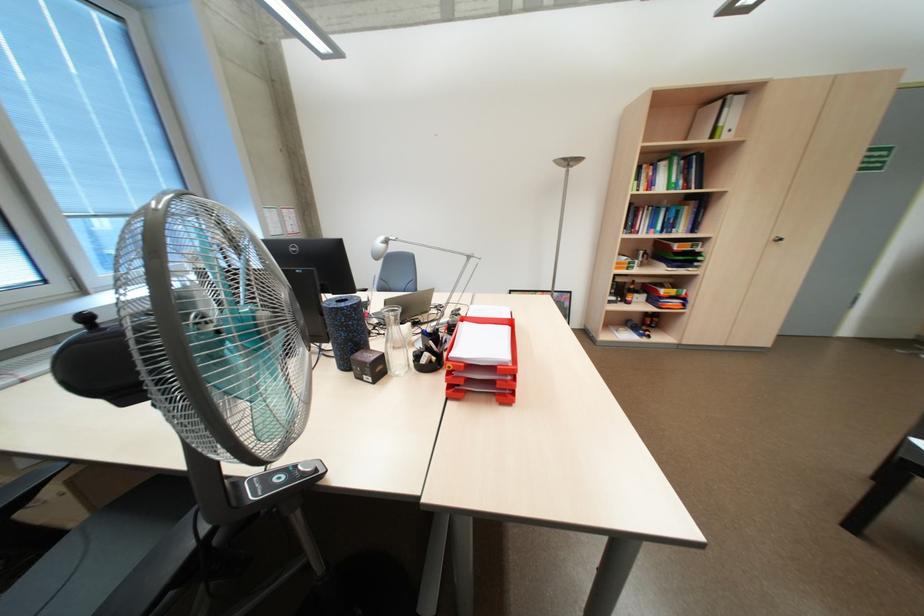
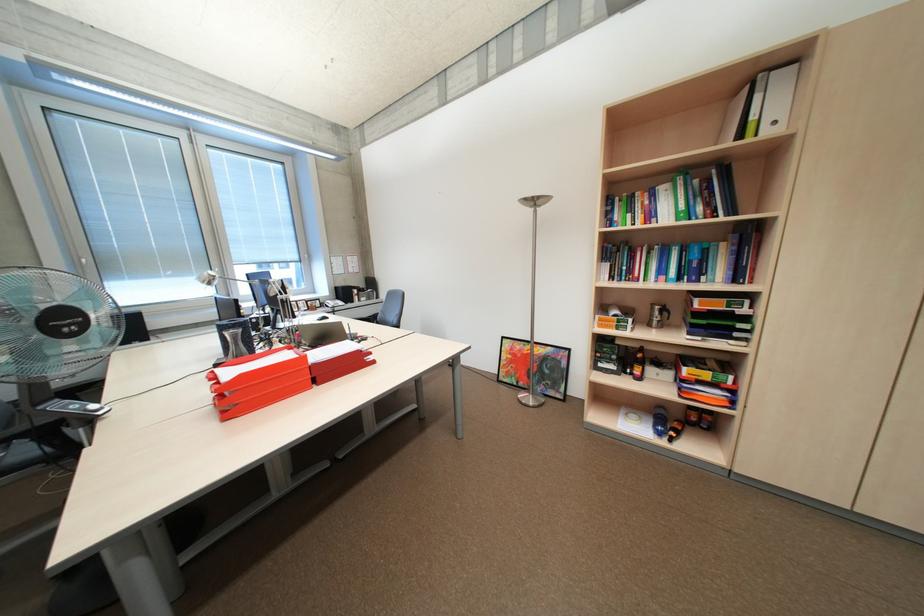
In the second image, find the point that corresponds to pixel 735 110 in the first image.

(768, 97)